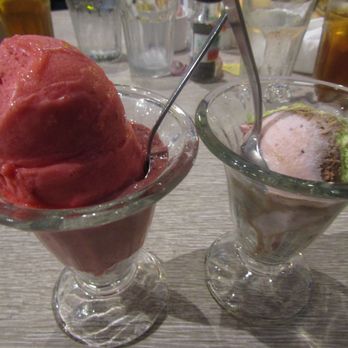
This screenshot has width=348, height=348. In order to click on cup in this screenshot , I will do `click(157, 36)`, `click(102, 29)`, `click(265, 30)`, `click(275, 207)`, `click(127, 225)`.